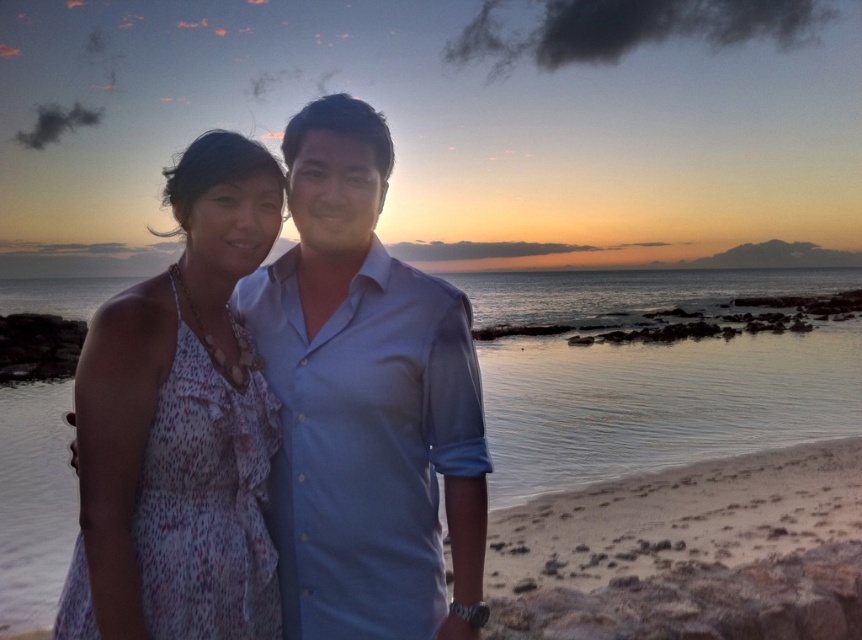
Question: Which point appears farthest from the camera in this image?

Choices:
 (A) (614, 419)
 (B) (217, 202)

Answer: (A)

Question: Is light blue shirt at center positioned in front of clear water at center?

Choices:
 (A) yes
 (B) no

Answer: (A)

Question: Is light blue shirt at center bigger than clear water at center?

Choices:
 (A) no
 (B) yes

Answer: (A)

Question: Which is nearer to the clear water at center?

Choices:
 (A) white dotted dress at left
 (B) light blue shirt at center

Answer: (A)

Question: Which of the following is the farthest from the observer?

Choices:
 (A) (607, 307)
 (B) (207, 342)

Answer: (A)

Question: Does light blue shirt at center appear under white dotted dress at left?

Choices:
 (A) yes
 (B) no

Answer: (B)